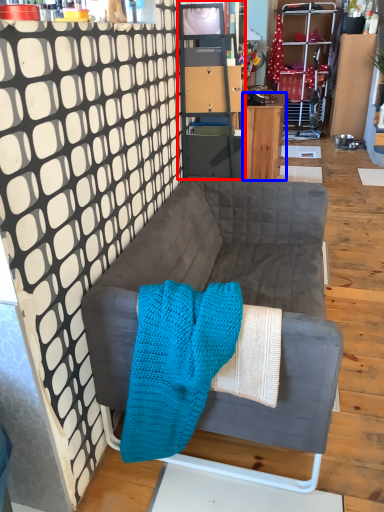
Question: Which object is closer to the camera taking this photo, cabinetry (highlighted by a red box) or desk (highlighted by a blue box)?

Choices:
 (A) cabinetry
 (B) desk

Answer: (A)